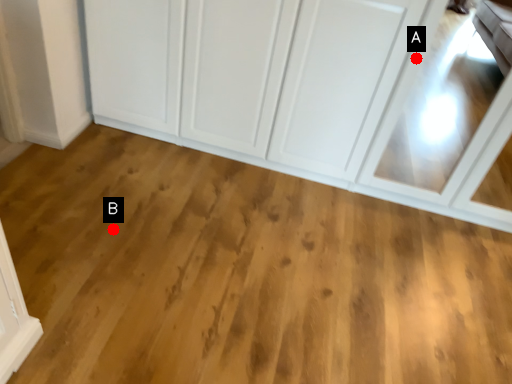
Question: Two points are circled on the image, labeled by A and B beside each circle. Which point is further to the camera?

Choices:
 (A) A is further
 (B) B is further

Answer: (B)